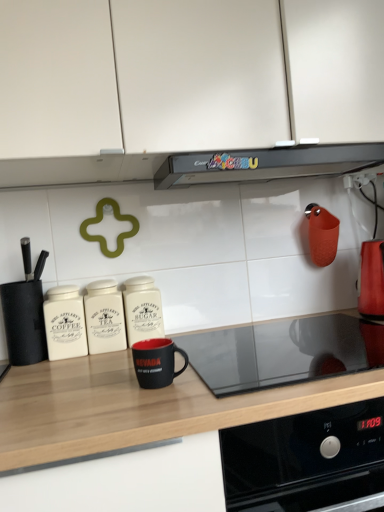
Question: From the image's perspective, is white matte cabinet at upper center on top of shiny metallic kettle at right, marked as the 1th kitchen appliance in a right-to-left arrangement?

Choices:
 (A) no
 (B) yes

Answer: (B)

Question: Is white matte cabinet at upper center positioned in front of shiny metallic kettle at right, the 6th kitchen appliance positioned from the left?

Choices:
 (A) no
 (B) yes

Answer: (B)

Question: Is shiny metallic kettle at right, marked as the 1th kitchen appliance in a right-to-left arrangement, surrounded by white matte cabinet at upper center?

Choices:
 (A) yes
 (B) no

Answer: (B)

Question: Does white matte cabinet at upper center have a greater height compared to shiny metallic kettle at right, marked as the 1th kitchen appliance in a right-to-left arrangement?

Choices:
 (A) yes
 (B) no

Answer: (A)

Question: Is white matte cabinet at upper center to the left of shiny metallic kettle at right, marked as the 1th kitchen appliance in a right-to-left arrangement, from the viewer's perspective?

Choices:
 (A) no
 (B) yes

Answer: (B)

Question: Considering the positions of black matte mug at center, the third kitchen appliance in the right-to-left sequence, and black matte countertop at center in the image, is black matte mug at center, the third kitchen appliance in the right-to-left sequence, bigger or smaller than black matte countertop at center?

Choices:
 (A) small
 (B) big

Answer: (A)

Question: From a real-world perspective, is black matte mug at center, placed as the 4th kitchen appliance when sorted from left to right, above or below black matte countertop at center?

Choices:
 (A) below
 (B) above

Answer: (B)

Question: Does point (134, 349) appear closer or farther from the camera than point (8, 382)?

Choices:
 (A) closer
 (B) farther

Answer: (A)

Question: Is black matte mug at center, placed as the 4th kitchen appliance when sorted from left to right, taller or shorter than black matte countertop at center?

Choices:
 (A) short
 (B) tall

Answer: (A)

Question: Based on their sizes in the image, would you say white ceramic coffee canister at left, which ranks as the 5th kitchen appliance in right-to-left order, is bigger or smaller than black matte knife block at left, which appears as the 6th kitchen appliance when viewed from the right?

Choices:
 (A) big
 (B) small

Answer: (B)

Question: From a real-world perspective, is white ceramic coffee canister at left, which ranks as the 5th kitchen appliance in right-to-left order, physically located above or below black matte knife block at left, which appears as the 6th kitchen appliance when viewed from the right?

Choices:
 (A) below
 (B) above

Answer: (A)

Question: Is white ceramic coffee canister at left, which ranks as the 5th kitchen appliance in right-to-left order, wider or thinner than black matte knife block at left, arranged as the first kitchen appliance when viewed from the left?

Choices:
 (A) wide
 (B) thin

Answer: (B)

Question: Is point (77, 329) closer or farther from the camera than point (34, 314)?

Choices:
 (A) farther
 (B) closer

Answer: (A)

Question: Visually, is white ceramic coffee canister at left, which ranks as the 5th kitchen appliance in right-to-left order, positioned to the left or to the right of white ceramic canister at center, which is counted as the fourth kitchen appliance, starting from the right?

Choices:
 (A) left
 (B) right

Answer: (A)

Question: Do you think white ceramic coffee canister at left, which ranks as the second kitchen appliance in left-to-right order, is within white ceramic canister at center, which is counted as the fourth kitchen appliance, starting from the right, or outside of it?

Choices:
 (A) inside
 (B) outside

Answer: (B)